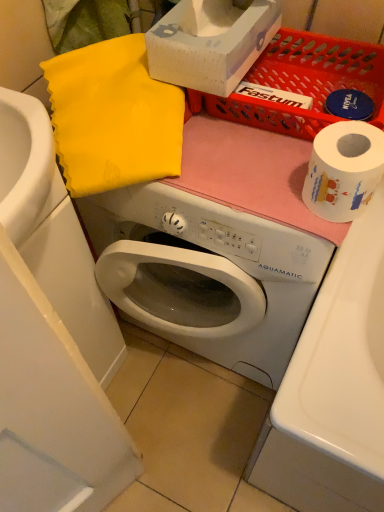
At what (x,y) coordinates should I click in order to perform the action: click on free space to the left of white paper at right. Please return your answer as a coordinate pair (x, y). The width and height of the screenshot is (384, 512). Looking at the image, I should click on (241, 184).